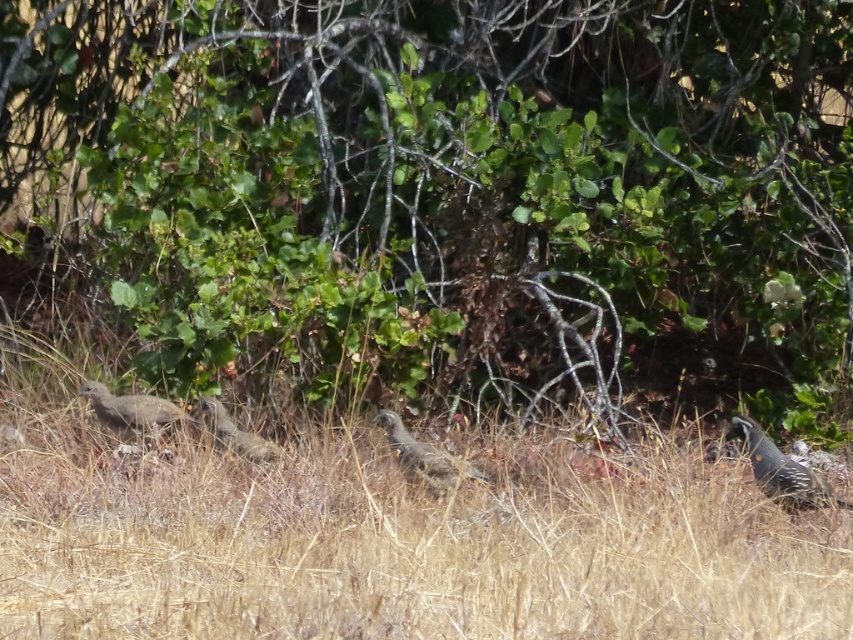
Question: Which point is closer to the camera?

Choices:
 (A) gray speckled bird at center
 (B) speckled feathered quail at right

Answer: (B)

Question: Which object is the closest to the green leafy tree at center?

Choices:
 (A) gray speckled bird at center
 (B) speckled feathered quail at right

Answer: (A)

Question: Can you confirm if green leafy tree at center is positioned to the left of dry grass at center?

Choices:
 (A) no
 (B) yes

Answer: (B)

Question: Which object is positioned closest to the speckled brown bird at left?

Choices:
 (A) dry grass at center
 (B) green leafy tree at center

Answer: (A)

Question: Is green leafy tree at center wider than dry grass at center?

Choices:
 (A) yes
 (B) no

Answer: (A)

Question: Does speckled feathered quail at right have a smaller size compared to speckled brown bird at left?

Choices:
 (A) yes
 (B) no

Answer: (B)